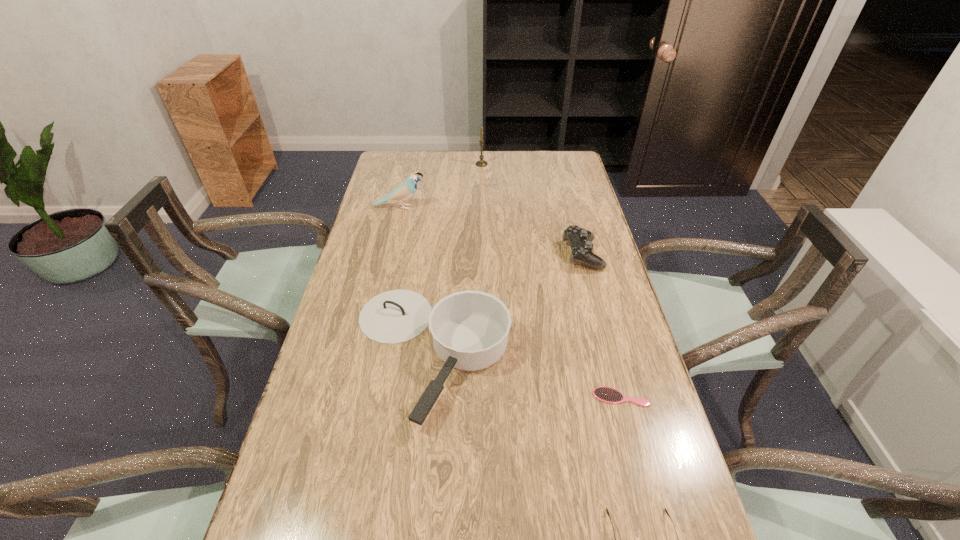
Find the location of `free space located 0.190m on the left of the shortest object`. free space located 0.190m on the left of the shortest object is located at coordinates (512, 397).

I want to click on object at the far edge, so click(x=481, y=163).

Where is `bird positioned at the left edge`? bird positioned at the left edge is located at coordinates (405, 190).

Locate an element on the screen. Image resolution: width=960 pixels, height=540 pixels. saucepan present at the left edge is located at coordinates (470, 329).

The height and width of the screenshot is (540, 960). I want to click on control located at the right edge, so click(x=579, y=239).

At what (x,y) coordinates should I click in order to perform the action: click on hairbrush situated at the right edge. Please return your answer as a coordinate pair (x, y). Looking at the image, I should click on (609, 395).

Identify the location of free space at the far edge of the desktop. click(x=518, y=164).

This screenshot has width=960, height=540. I want to click on free spot at the left edge of the desktop, so click(374, 344).

The width and height of the screenshot is (960, 540). I want to click on free space at the right edge, so click(x=592, y=392).

Locate an element on the screen. This screenshot has height=540, width=960. vacant space at the far right corner of the desktop is located at coordinates (557, 157).